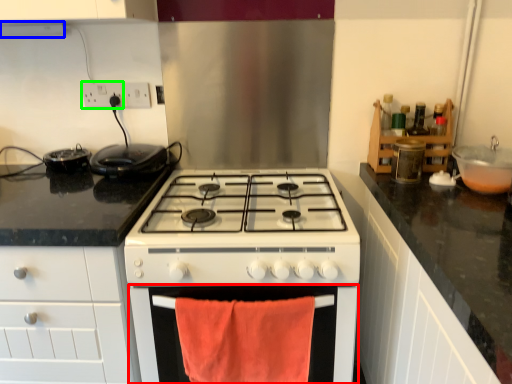
Question: Based on their relative distances, which object is farther from oven (highlighted by a red box)? Choose from exhaust hood (highlighted by a blue box) and electric outlet (highlighted by a green box).

Choices:
 (A) exhaust hood
 (B) electric outlet

Answer: (A)